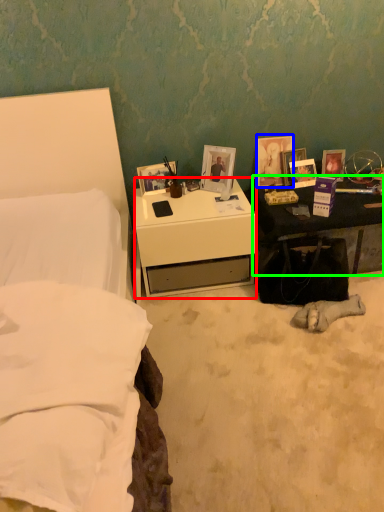
Question: Considering the real-world distances, which object is farthest from desk (highlighted by a red box)? picture frame (highlighted by a blue box) or nightstand (highlighted by a green box)?

Choices:
 (A) picture frame
 (B) nightstand

Answer: (A)